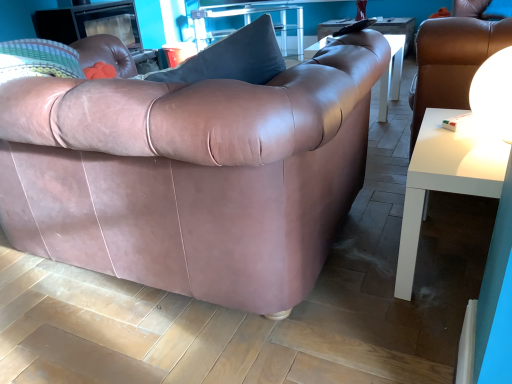
Where is `clear glass table at upper center, the 1th table from the top`? Image resolution: width=512 pixels, height=384 pixels. clear glass table at upper center, the 1th table from the top is located at coordinates (248, 22).

Describe the element at coordinates (445, 179) in the screenshot. I see `white glossy table at lower right, arranged as the second table when viewed from the top` at that location.

The image size is (512, 384). I want to click on white glossy side table at right, so click(x=452, y=62).

Is white glossy sphere at upper right looking in the opposite direction of white glossy table at lower right, arranged as the second table when viewed from the top?

No, white glossy sphere at upper right is not facing the opposite direction of white glossy table at lower right, arranged as the second table when viewed from the top.

Is point (498, 80) closer to viewer compared to point (452, 167)?

Yes, point (498, 80) is in front of point (452, 167).

Is white glossy sphere at upper right not close to white glossy table at lower right, marked as the second table in a back-to-front arrangement?

white glossy sphere at upper right is actually quite close to white glossy table at lower right, marked as the second table in a back-to-front arrangement.

From a real-world perspective, relative to matte leather couch at center, is clear glass table at upper center, the 1th table from the top, vertically above or below?

Clearly, from a real-world perspective, clear glass table at upper center, the 1th table from the top, is below matte leather couch at center.

Based on the photo, is clear glass table at upper center, marked as the second table in a front-to-back arrangement, wider than matte leather couch at center?

No, clear glass table at upper center, marked as the second table in a front-to-back arrangement, is not wider than matte leather couch at center.

Are clear glass table at upper center, the second table ordered from the bottom, and matte leather couch at center beside each other?

No, clear glass table at upper center, the second table ordered from the bottom, is not next to matte leather couch at center.

Between clear glass table at upper center, which appears as the 2th table when viewed from the right, and matte leather couch at center, which one is positioned behind?

Positioned behind is clear glass table at upper center, which appears as the 2th table when viewed from the right.

Are white glossy side table at right and white glossy table at lower right, which appears as the 1th table when viewed from the front, making contact?

No, white glossy side table at right is not next to white glossy table at lower right, which appears as the 1th table when viewed from the front.

Between white glossy side table at right and white glossy table at lower right, which is counted as the 2th table, starting from the left, which one has larger width?

white glossy side table at right is wider.

Could you tell me if white glossy side table at right is turned towards white glossy table at lower right, acting as the first table starting from the bottom?

No, white glossy side table at right is not oriented towards white glossy table at lower right, acting as the first table starting from the bottom.

Is white glossy side table at right outside of white glossy table at lower right, which appears as the 1th table when viewed from the front?

Yes, white glossy side table at right is outside of white glossy table at lower right, which appears as the 1th table when viewed from the front.

Between point (409, 239) and point (324, 149), which one is positioned behind?

The point (409, 239) is farther.

From the image's perspective, does white glossy table at lower right, marked as the second table in a back-to-front arrangement, appear higher than matte leather couch at center?

Incorrect, from the image's perspective, white glossy table at lower right, marked as the second table in a back-to-front arrangement, is lower than matte leather couch at center.

Is white glossy table at lower right, arranged as the second table when viewed from the top, positioned with its back to matte leather couch at center?

No, matte leather couch at center is not at the back of white glossy table at lower right, arranged as the second table when viewed from the top.

From a real-world perspective, is white glossy table at lower right, which appears as the 1th table when viewed from the front, positioned above or below matte leather couch at center?

white glossy table at lower right, which appears as the 1th table when viewed from the front, is situated lower than matte leather couch at center in the real world.

Considering the sizes of objects white glossy sphere at upper right and matte leather couch at center in the image provided, who is taller, white glossy sphere at upper right or matte leather couch at center?

matte leather couch at center is taller.

Can you confirm if white glossy sphere at upper right is positioned to the left of matte leather couch at center?

Incorrect, white glossy sphere at upper right is not on the left side of matte leather couch at center.

Is the position of white glossy sphere at upper right more distant than that of matte leather couch at center?

Yes, white glossy sphere at upper right is behind matte leather couch at center.

Consider the image. From the image's perspective, which is above, white glossy sphere at upper right or matte leather couch at center?

white glossy sphere at upper right appears higher in the image.

Considering their positions, is white glossy table at lower right, marked as the second table in a back-to-front arrangement, located in front of or behind clear glass table at upper center, which appears as the 2th table when viewed from the right?

Clearly, white glossy table at lower right, marked as the second table in a back-to-front arrangement, is in front of clear glass table at upper center, which appears as the 2th table when viewed from the right.

Where is `table lying behind the white glossy table at lower right, marked as the second table in a back-to-front arrangement`? The image size is (512, 384). table lying behind the white glossy table at lower right, marked as the second table in a back-to-front arrangement is located at coordinates (248, 22).

Which object is wider, white glossy table at lower right, marked as the second table in a back-to-front arrangement, or clear glass table at upper center, the 1th table from the top?

With larger width is clear glass table at upper center, the 1th table from the top.

Does white glossy table at lower right, which is counted as the 2th table, starting from the left, have a greater height compared to clear glass table at upper center, the 1th table positioned from the back?

In fact, white glossy table at lower right, which is counted as the 2th table, starting from the left, may be shorter than clear glass table at upper center, the 1th table positioned from the back.

Between point (283, 29) and point (494, 92), which one is positioned behind?

The point (283, 29) is more distant.

Does clear glass table at upper center, the 1th table positioned from the back, have a greater height compared to white glossy sphere at upper right?

Yes.

How far apart are clear glass table at upper center, which appears as the 2th table when viewed from the right, and white glossy sphere at upper right?

A distance of 2.87 meters exists between clear glass table at upper center, which appears as the 2th table when viewed from the right, and white glossy sphere at upper right.

Which object is further away from the camera, clear glass table at upper center, the 1th table positioned from the back, or white glossy sphere at upper right?

clear glass table at upper center, the 1th table positioned from the back, is further from the camera.

Locate an element on the screen. lamp above the white glossy table at lower right, which is counted as the 2th table, starting from the left (from a real-world perspective) is located at coordinates (494, 94).

At what (x,y) coordinates should I click in order to perform the action: click on table that is the 1st one when counting rightward from the matte leather couch at center. Please return your answer as a coordinate pair (x, y). The image size is (512, 384). Looking at the image, I should click on (248, 22).

Based on their spatial positions, is clear glass table at upper center, the 1th table from the top, or white glossy side table at right closer to white glossy sphere at upper right?

white glossy side table at right is closer to white glossy sphere at upper right.

Estimate the real-world distances between objects in this image. Which object is further from white glossy sphere at upper right, clear glass table at upper center, which appears as the 2th table when viewed from the right, or white glossy table at lower right, acting as the 1th table starting from the right?

clear glass table at upper center, which appears as the 2th table when viewed from the right, lies further to white glossy sphere at upper right than the other object.

Estimate the real-world distances between objects in this image. Which object is further from white glossy table at lower right, arranged as the second table when viewed from the top, white glossy side table at right or white glossy sphere at upper right?

white glossy side table at right is positioned further to the anchor white glossy table at lower right, arranged as the second table when viewed from the top.

Looking at the image, which one is located closer to white glossy side table at right, matte leather couch at center or clear glass table at upper center, the 1th table positioned from the back?

Based on the image, matte leather couch at center appears to be nearer to white glossy side table at right.

Estimate the real-world distances between objects in this image. Which object is closer to clear glass table at upper center, the 1th table from the top, white glossy side table at right or white glossy sphere at upper right?

white glossy side table at right is positioned closer to the anchor clear glass table at upper center, the 1th table from the top.

Considering their positions, is clear glass table at upper center, arranged as the 1th table when viewed from the left, positioned closer to white glossy side table at right than matte leather couch at center?

Based on the image, matte leather couch at center appears to be nearer to white glossy side table at right.

Estimate the real-world distances between objects in this image. Which object is closer to white glossy sphere at upper right, matte leather couch at center or clear glass table at upper center, marked as the second table in a front-to-back arrangement?

matte leather couch at center is positioned closer to the anchor white glossy sphere at upper right.

Estimate the real-world distances between objects in this image. Which object is closer to clear glass table at upper center, marked as the second table in a front-to-back arrangement, white glossy side table at right or white glossy table at lower right, acting as the 1th table starting from the right?

white glossy side table at right lies closer to clear glass table at upper center, marked as the second table in a front-to-back arrangement, than the other object.

Identify the location of chair positioned between matte leather couch at center and clear glass table at upper center, the second table ordered from the bottom, from near to far. (452, 62).

At what (x,y) coordinates should I click in order to perform the action: click on table positioned between matte leather couch at center and clear glass table at upper center, marked as the second table in a front-to-back arrangement, from near to far. Please return your answer as a coordinate pair (x, y). This screenshot has height=384, width=512. Looking at the image, I should click on (445, 179).

What are the coordinates of `chair located between white glossy table at lower right, acting as the 1th table starting from the right, and clear glass table at upper center, which appears as the 2th table when viewed from the right, in the depth direction` in the screenshot? It's located at (452, 62).

Where is `chair between white glossy sphere at upper right and clear glass table at upper center, the second table ordered from the bottom, in the front-back direction`? This screenshot has width=512, height=384. chair between white glossy sphere at upper right and clear glass table at upper center, the second table ordered from the bottom, in the front-back direction is located at coordinates (452, 62).